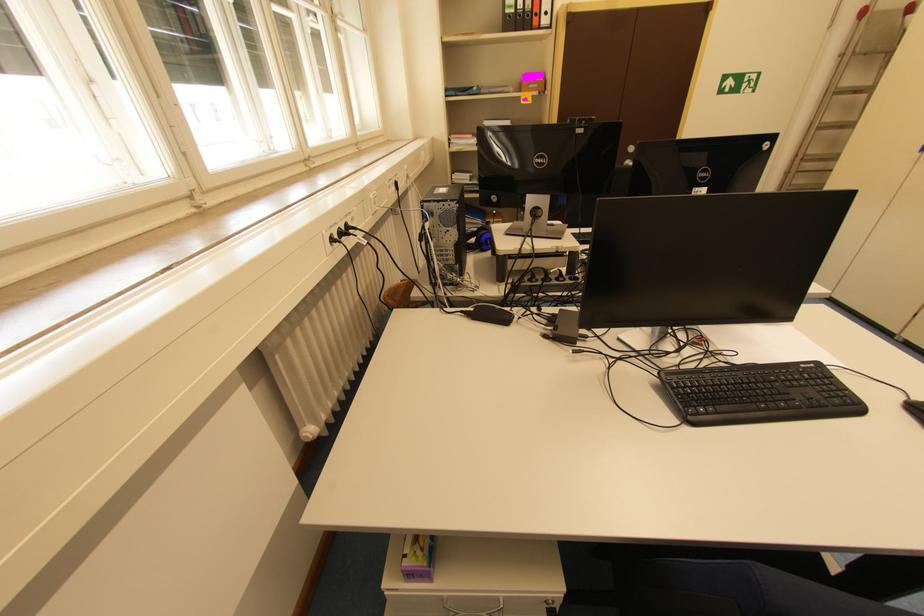
Identify the location of chair sitting surface. (674, 560).